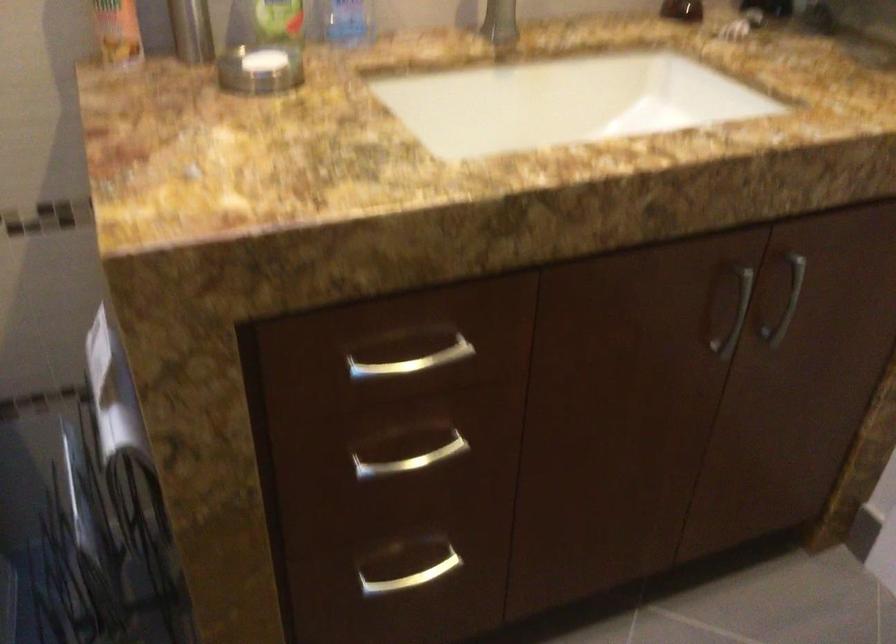
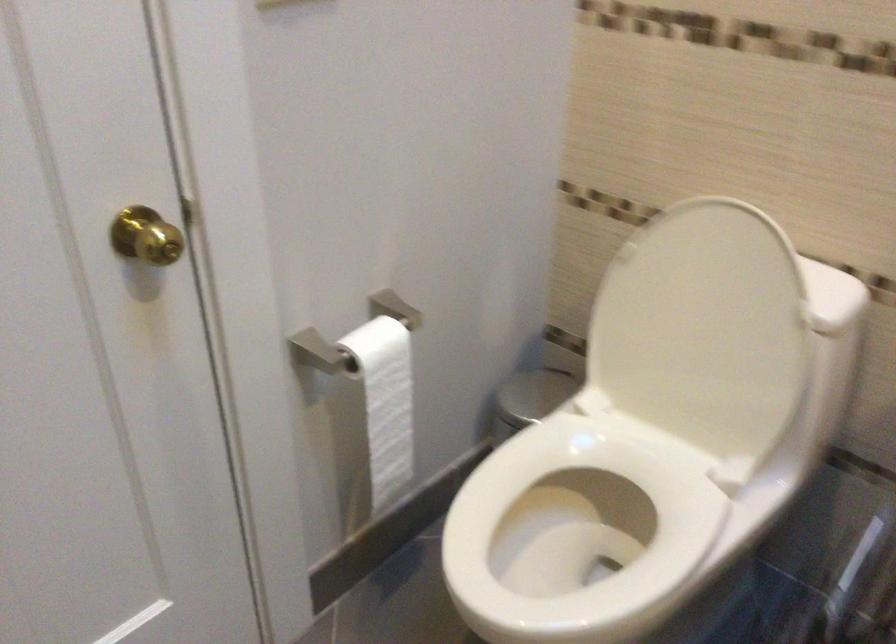
Question: The camera is either moving clockwise (left) or counter-clockwise (right) around the object. The first image is from the beginning of the video and the second image is from the end. Is the camera moving left or right when shooting the video?

Choices:
 (A) Left
 (B) Right

Answer: (B)